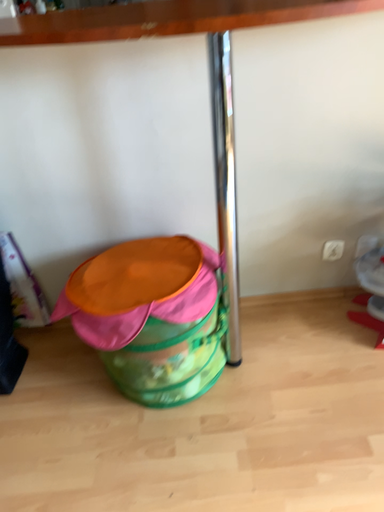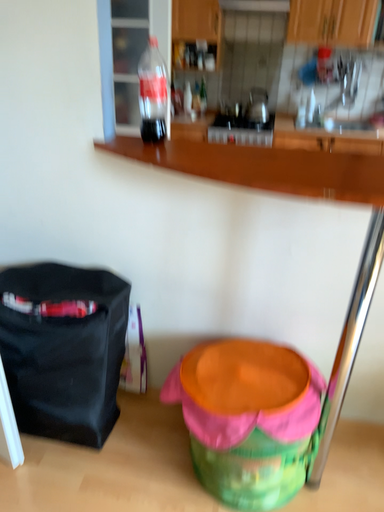
Question: How did the camera likely rotate when shooting the video?

Choices:
 (A) rotated right
 (B) rotated left

Answer: (B)